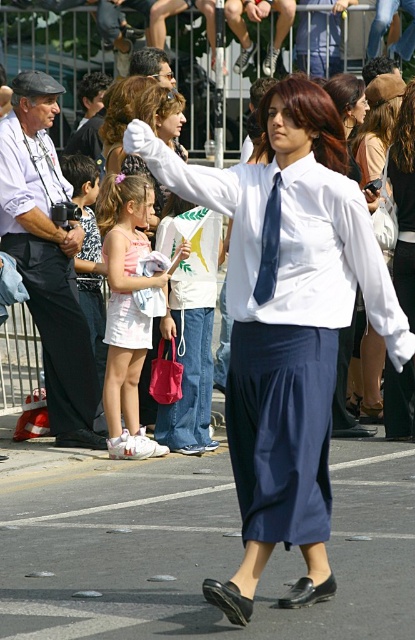
Question: Among these objects, which one is farthest from the camera?

Choices:
 (A) dark blue silk tie at center
 (B) white satin dress at center
 (C) white cotton dress at center
 (D) white smooth dress shirt at center

Answer: (B)

Question: Which point appears closest to the camera in this image?

Choices:
 (A) tap(109, 196)
 (B) tap(270, 259)

Answer: (B)

Question: Is white smooth dress shirt at center bigger than white satin dress at center?

Choices:
 (A) yes
 (B) no

Answer: (A)

Question: Does white cotton dress at center appear under dark blue silk tie at center?

Choices:
 (A) yes
 (B) no

Answer: (A)

Question: Is white satin dress at center positioned behind dark blue silk tie at center?

Choices:
 (A) yes
 (B) no

Answer: (A)

Question: Which object is the farthest from the white cotton dress at center?

Choices:
 (A) white smooth dress shirt at center
 (B) white satin dress at center
 (C) dark blue silk tie at center

Answer: (C)